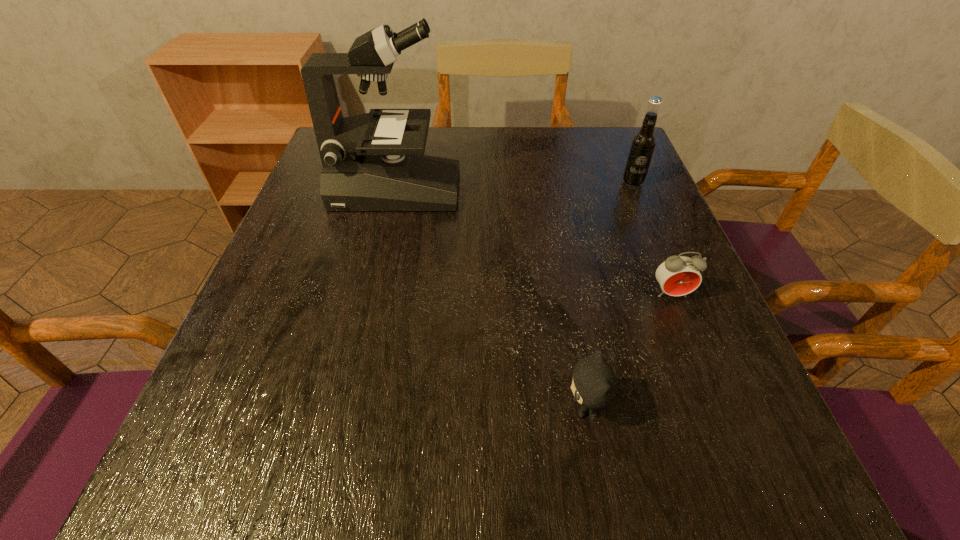
Identify the location of free space between the alarm clock and the root beer. The width and height of the screenshot is (960, 540). (652, 239).

Locate an element on the screen. vacant area between the nearest object and the third farthest object is located at coordinates (628, 351).

Locate an element on the screen. This screenshot has width=960, height=540. empty space between the third shortest object and the alarm clock is located at coordinates (652, 239).

Locate an element on the screen. This screenshot has width=960, height=540. object that is the second nearest to the third object from right to left is located at coordinates pyautogui.click(x=375, y=161).

This screenshot has width=960, height=540. What are the coordinates of `object that is the third closest to the root beer` in the screenshot? It's located at point(594,385).

This screenshot has height=540, width=960. Identify the location of free spot that satisfies the following two spatial constraints: 1. on the label of the second tallest object; 2. on the front-facing side of the kitten. (727, 408).

You are a GUI agent. You are given a task and a screenshot of the screen. Output one action in this format:
    pyautogui.click(x=<x>, y=<y>)
    Task: Click on the free space that satisfies the following two spatial constraints: 1. on the label of the third shortest object; 2. through the eyepieces of the tallest object
    
    Given the screenshot: What is the action you would take?
    pyautogui.click(x=636, y=190)

I want to click on free spot that satisfies the following two spatial constraints: 1. on the face of the alarm clock; 2. on the front-facing side of the kitten, so click(x=716, y=408).

The image size is (960, 540). Find the location of `free location that satisfies the following two spatial constraints: 1. on the label of the root beer; 2. on the front-facing side of the second object from left to right`. free location that satisfies the following two spatial constraints: 1. on the label of the root beer; 2. on the front-facing side of the second object from left to right is located at coordinates (727, 408).

Image resolution: width=960 pixels, height=540 pixels. In order to click on vacant space that satisfies the following two spatial constraints: 1. on the label of the third shortest object; 2. on the front-facing side of the third object from right to left in this screenshot , I will do `click(727, 408)`.